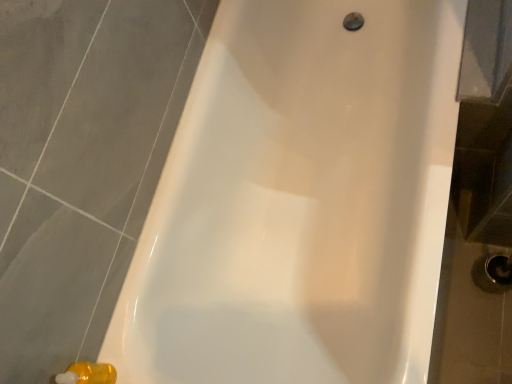
The image size is (512, 384). What are the coordinates of `vacant area located to the right-hand side of translucent yellow soap at lower left` in the screenshot? It's located at (133, 344).